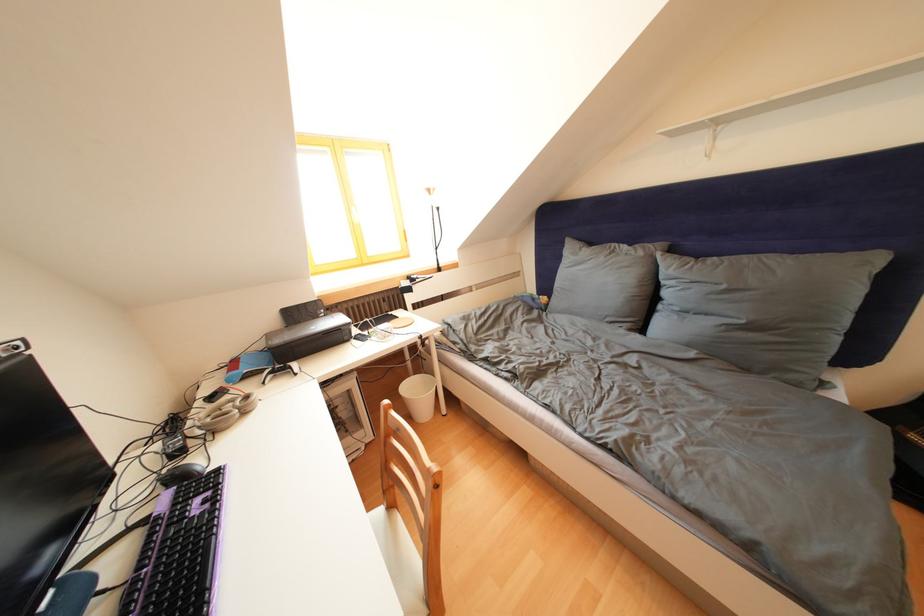
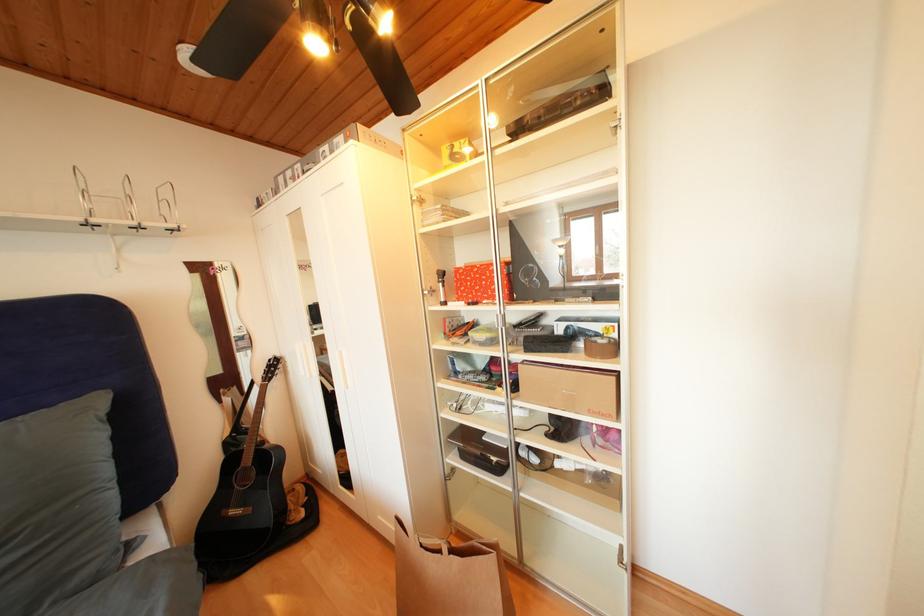
Question: How did the camera likely rotate?

Choices:
 (A) Left
 (B) Right
 (C) Up
 (D) Down

Answer: (B)